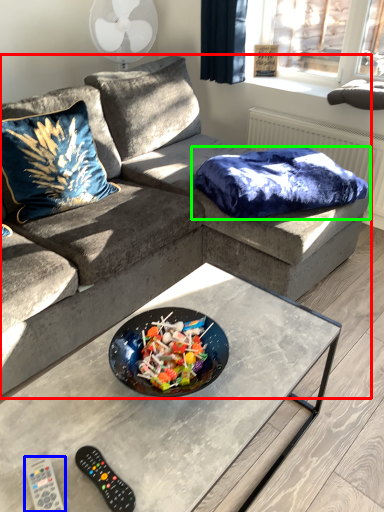
Question: Which object is positioned closest to studio couch (highlighted by a red box)? Select from remote (highlighted by a blue box) and blanket (highlighted by a green box).

Choices:
 (A) remote
 (B) blanket

Answer: (B)